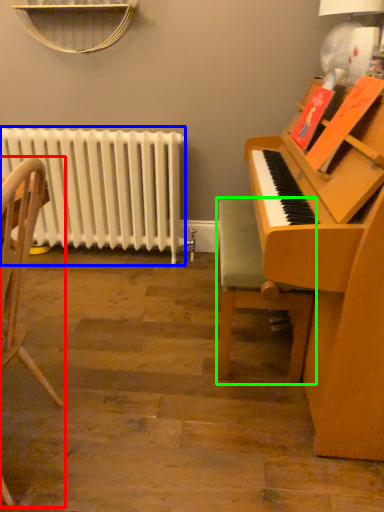
Question: Based on their relative distances, which object is farther from chair (highlighted by a red box)? Choose from radiator (highlighted by a blue box) and chair (highlighted by a green box).

Choices:
 (A) radiator
 (B) chair

Answer: (A)